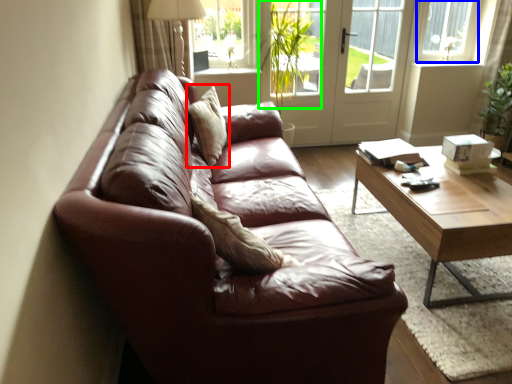
Question: Which is farther away from pillow (highlighted by a red box)? window frame (highlighted by a blue box) or plant (highlighted by a green box)?

Choices:
 (A) window frame
 (B) plant

Answer: (A)